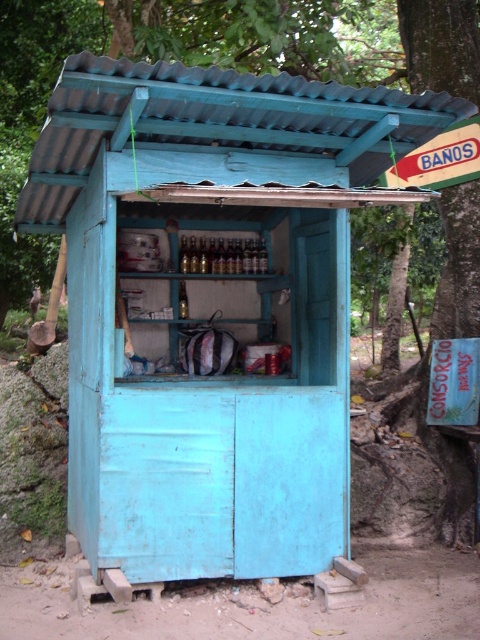
Does translucent glass bottles at center have a larger size compared to translucent glass bottle at center?

Yes, translucent glass bottles at center is bigger than translucent glass bottle at center.

Is translucent glass bottles at center below translucent glass bottle at center?

Indeed, translucent glass bottles at center is positioned under translucent glass bottle at center.

The width and height of the screenshot is (480, 640). What do you see at coordinates (223, 257) in the screenshot? I see `translucent glass bottles at center` at bounding box center [223, 257].

The width and height of the screenshot is (480, 640). I want to click on translucent glass bottles at center, so click(223, 257).

Can you confirm if translucent glass bottles at center is taller than matte plastic bottle at center?

No.

Can you confirm if translucent glass bottles at center is thinner than matte plastic bottle at center?

No.

Is point (237, 273) positioned behind point (183, 307)?

Yes, point (237, 273) is farther from viewer.

The width and height of the screenshot is (480, 640). In order to click on translucent glass bottles at center in this screenshot , I will do `click(223, 257)`.

Is matte plastic bottle at center closer to camera compared to translucent glass bottle at center?

No, it is not.

Between point (179, 291) and point (186, 257), which one is positioned behind?

The point (179, 291) is more distant.

Where is `matte plastic bottle at center`? This screenshot has height=640, width=480. matte plastic bottle at center is located at coordinates (182, 301).